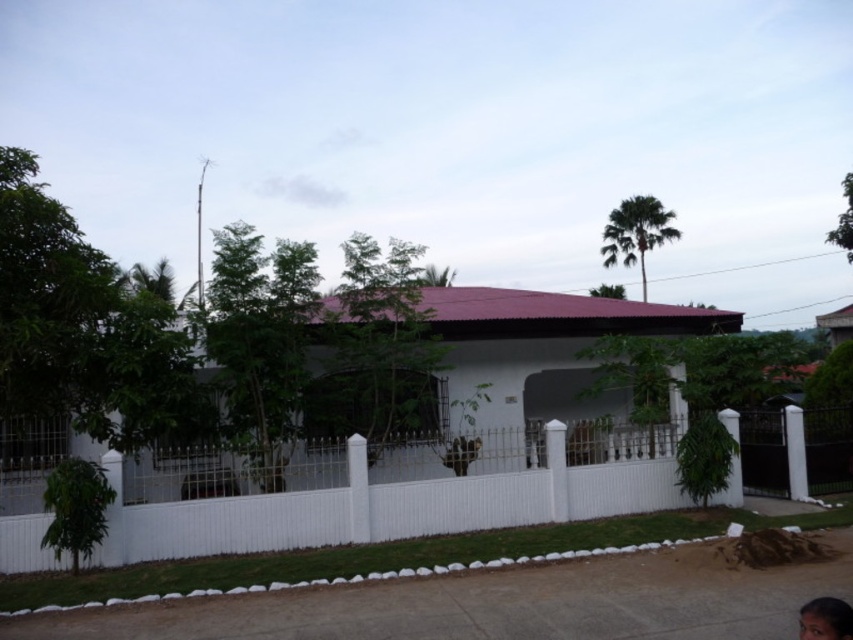
Looking at this image, you are a delivery person approaching the house and see the white picket fence at center and the smooth skin face at lower right. Which object is closer to the ground?

The white picket fence at center is closer to the ground because it is positioned below the smooth skin face at lower right.

You are standing at the point marked as point (x=383, y=508) in the residential building scene. What object is located exactly at that point?

The point (x=383, y=508) corresponds to the white picket fence at center.